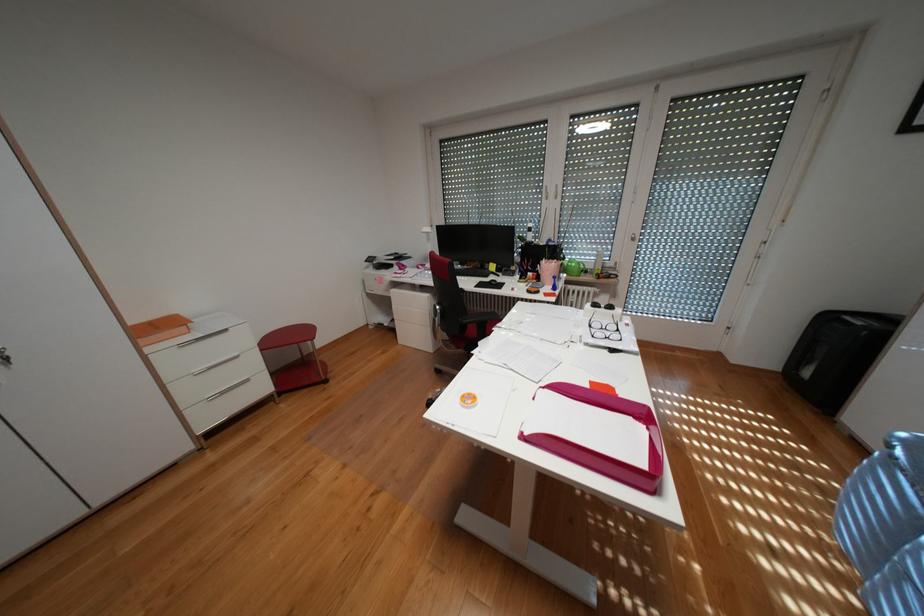
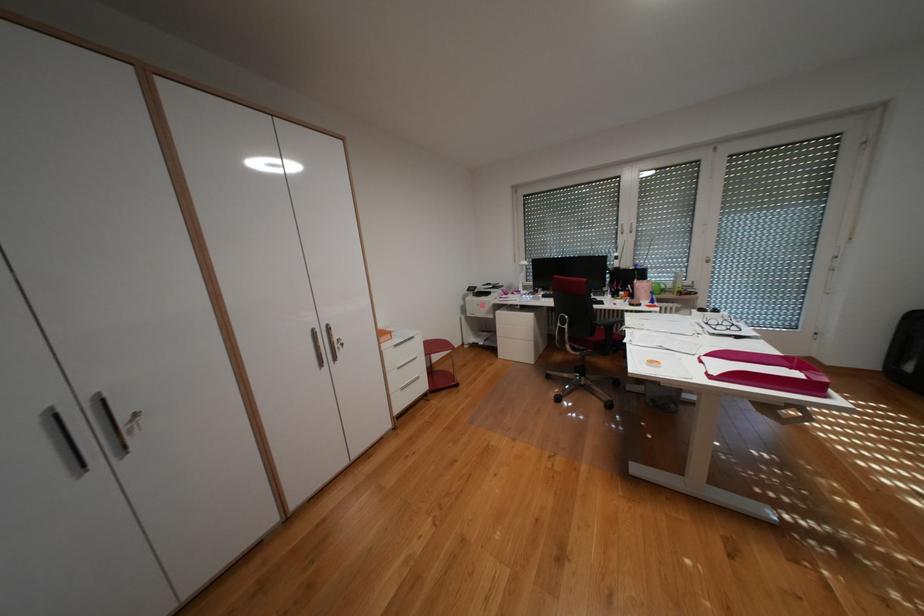
The images are taken continuously from a first-person perspective. In which direction are you moving?

The movement direction of the cameraman is left, backward.